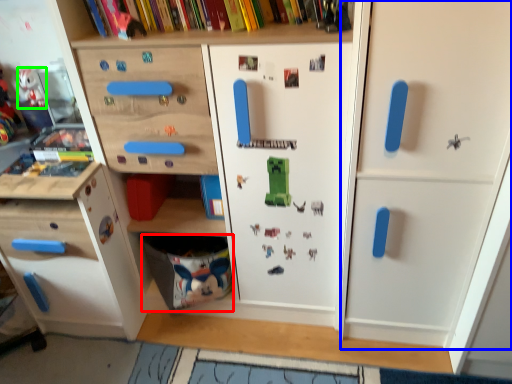
Question: Which object is the farthest from drawer (highlighted by a red box)? Choose among these: door (highlighted by a blue box) or toy (highlighted by a green box).

Choices:
 (A) door
 (B) toy

Answer: (B)